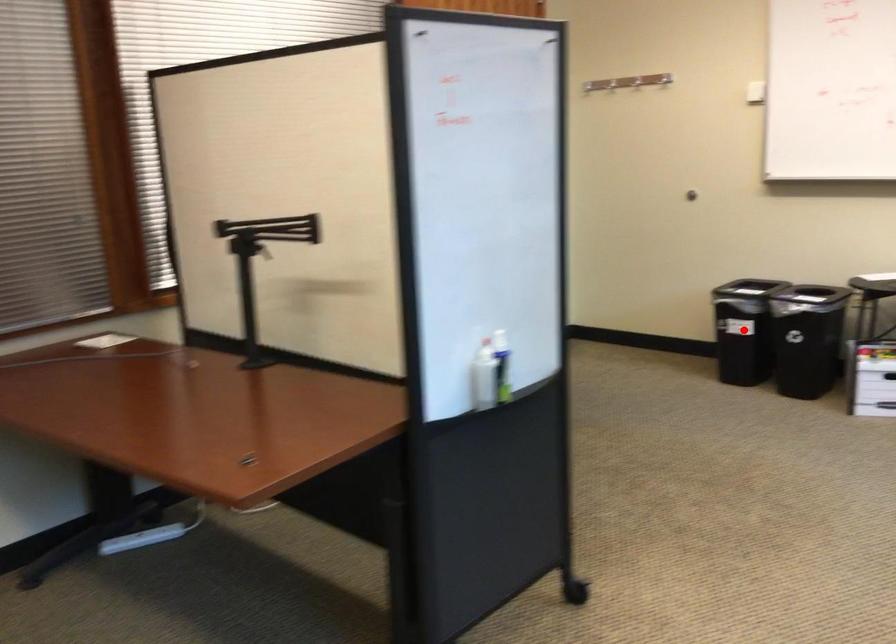
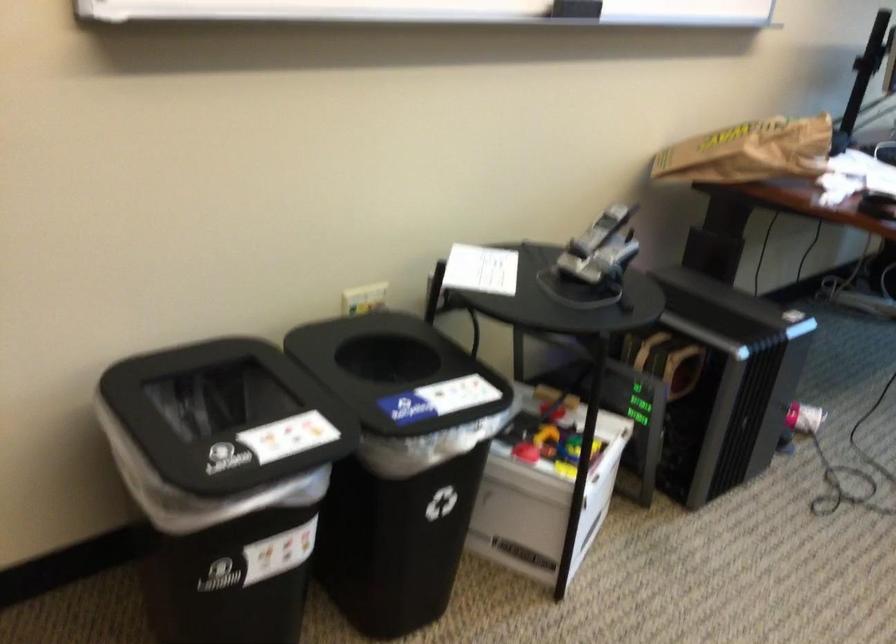
Question: I am providing you with two images of the same scene from different viewpoints. A red point is marked on the first image. Can you still see the location of the red point in image 2?

Choices:
 (A) Yes
 (B) No

Answer: (B)